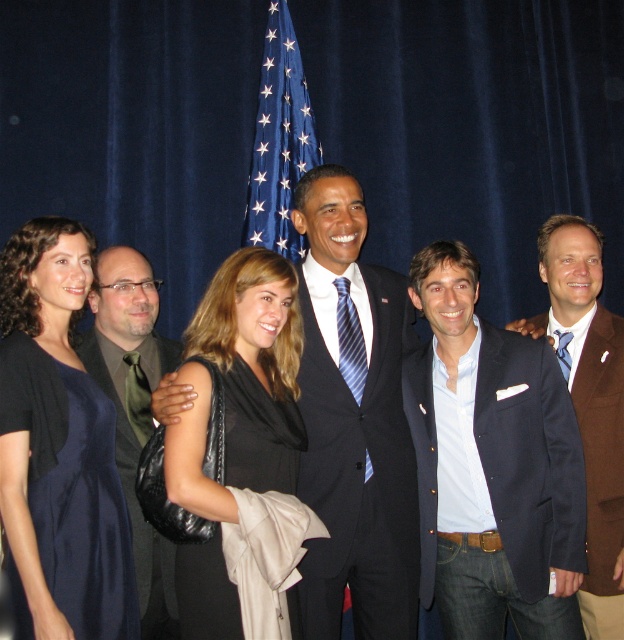
Is navy blue dress at left closer to camera compared to green satin tie at left?

A: Yes, it is.

Which of these two, navy blue dress at left or green satin tie at left, stands shorter?

Result: Standing shorter between the two is navy blue dress at left.

This screenshot has height=640, width=624. In order to click on navy blue dress at left in this screenshot , I will do `click(59, 445)`.

The image size is (624, 640). Identify the location of navy blue dress at left. (59, 445).

Can you confirm if blue textured suit at center is bigger than brown textured suit at right?

Actually, blue textured suit at center might be smaller than brown textured suit at right.

In the scene shown: Which of these two, blue textured suit at center or brown textured suit at right, stands shorter?

blue textured suit at center is shorter.

Between point (532, 376) and point (610, 369), which one is positioned in front?

Point (532, 376) is in front.

This screenshot has width=624, height=640. I want to click on blue textured suit at center, so click(490, 465).

Does navy blue dress at left come in front of dark blue suit at center?

Yes, it is.

At what (x,y) coordinates should I click in order to perform the action: click on navy blue dress at left. Please return your answer as a coordinate pair (x, y). The height and width of the screenshot is (640, 624). Looking at the image, I should click on (59, 445).

You are a GUI agent. You are given a task and a screenshot of the screen. Output one action in this format:
    pyautogui.click(x=<x>, y=<y>)
    Task: Click on the navy blue dress at left
    
    Given the screenshot: What is the action you would take?
    pyautogui.click(x=59, y=445)